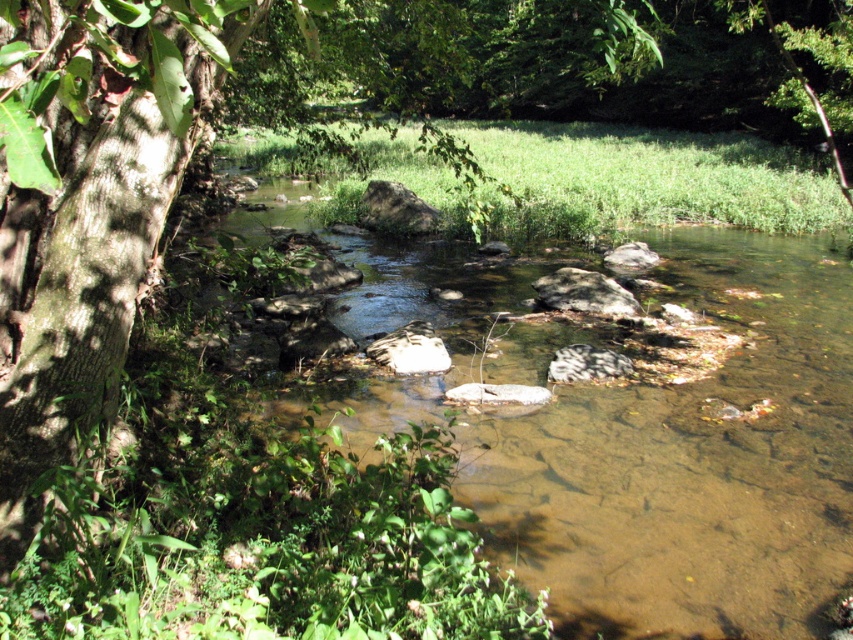
Is gray stone at center in front of smooth gray rock at center?

That is False.

Can you confirm if gray stone at center is shorter than smooth gray rock at center?

In fact, gray stone at center may be taller than smooth gray rock at center.

Image resolution: width=853 pixels, height=640 pixels. I want to click on gray stone at center, so click(585, 364).

How distant is brown rough tree trunk at left from white smooth rock at center?

brown rough tree trunk at left is 5.32 meters from white smooth rock at center.

Is brown rough tree trunk at left smaller than white smooth rock at center?

No, brown rough tree trunk at left is not smaller than white smooth rock at center.

Is point (70, 36) less distant than point (392, 332)?

Yes.

You are a GUI agent. You are given a task and a screenshot of the screen. Output one action in this format:
    pyautogui.click(x=<x>, y=<y>)
    Task: Click on the brown rough tree trunk at left
    Image resolution: width=853 pixels, height=640 pixels.
    Given the screenshot: What is the action you would take?
    click(x=86, y=205)

Does gray stone at center have a greater width compared to gray rock at center?

In fact, gray stone at center might be narrower than gray rock at center.

Identify the location of gray stone at center. The height and width of the screenshot is (640, 853). (585, 364).